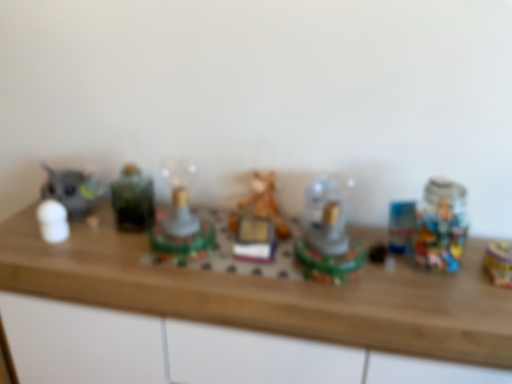
Question: Looking at the image, does gold metallic toy at right, the 7th toy positioned from the left, seem bigger or smaller compared to matte gray cat at left, the sixth toy in the right-to-left sequence?

Choices:
 (A) big
 (B) small

Answer: (B)

Question: Considering the positions of point (490, 269) and point (102, 193), is point (490, 269) closer or farther from the camera than point (102, 193)?

Choices:
 (A) farther
 (B) closer

Answer: (B)

Question: Based on their relative distances, which object is nearer to the translucent plastic toy at center, marked as the 2th toy in a right-to-left arrangement?

Choices:
 (A) white matte figurine at left, the first toy positioned from the left
 (B) wooden counter top at center
 (C) gold metallic toy at right, the 7th toy positioned from the left
 (D) matte gray cat at left, the sixth toy in the right-to-left sequence
 (E) orange plush bear at center, the third toy from the right

Answer: (E)

Question: Which object is the farthest from the shiny green plastic toy at center, marked as the fourth toy in a right-to-left arrangement?

Choices:
 (A) orange plush bear at center, which is the 5th toy from left to right
 (B) green glass jar at left, the fifth toy from the right
 (C) gold metallic toy at right, which ranks as the 1th toy in right-to-left order
 (D) matte gray cat at left, the sixth toy in the right-to-left sequence
 (E) white matte figurine at left, the first toy positioned from the left

Answer: (C)